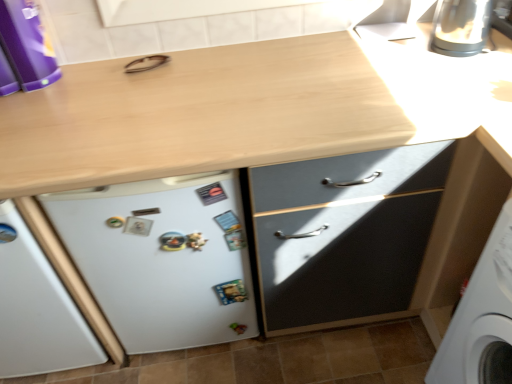
The width and height of the screenshot is (512, 384). What do you see at coordinates (161, 258) in the screenshot?
I see `white matte refrigerator at lower left` at bounding box center [161, 258].

Identify the location of satin silver kettle at upper right. [461, 27].

Does white matte refrigerator at lower left have a greater width compared to satin silver kettle at upper right?

In fact, white matte refrigerator at lower left might be narrower than satin silver kettle at upper right.

Is white matte refrigerator at lower left looking in the opposite direction of satin silver kettle at upper right?

No, satin silver kettle at upper right is not at the back of white matte refrigerator at lower left.

Considering the relative sizes of white matte refrigerator at lower left and satin silver kettle at upper right in the image provided, is white matte refrigerator at lower left smaller than satin silver kettle at upper right?

Incorrect, white matte refrigerator at lower left is not smaller in size than satin silver kettle at upper right.

From a real-world perspective, which object stands above the other?

In real-world perspective, satin silver kettle at upper right is above.

Which object is further away from the camera taking this photo, purple plastic container at upper left or satin silver kettle at upper right?

satin silver kettle at upper right is further away from the camera.

Can you confirm if purple plastic container at upper left is taller than satin silver kettle at upper right?

Correct, purple plastic container at upper left is much taller as satin silver kettle at upper right.

Is point (46, 82) positioned in front of point (445, 50)?

No.

From the image's perspective, is satin silver kettle at upper right below white matte refrigerator at lower left?

No.

Considering the relative positions of satin silver kettle at upper right and white matte refrigerator at lower left in the image provided, is satin silver kettle at upper right to the right of white matte refrigerator at lower left from the viewer's perspective?

Indeed, satin silver kettle at upper right is positioned on the right side of white matte refrigerator at lower left.

Does satin silver kettle at upper right have a smaller size compared to white matte refrigerator at lower left?

Yes, satin silver kettle at upper right is smaller than white matte refrigerator at lower left.

Could you tell me if satin silver kettle at upper right is facing white matte refrigerator at lower left?

No, satin silver kettle at upper right is not aimed at white matte refrigerator at lower left.

Considering the relative sizes of purple plastic container at upper left and white matte refrigerator at lower left in the image provided, is purple plastic container at upper left bigger than white matte refrigerator at lower left?

No, purple plastic container at upper left is not bigger than white matte refrigerator at lower left.

Is purple plastic container at upper left taller or shorter than white matte refrigerator at lower left?

Considering their sizes, purple plastic container at upper left has less height than white matte refrigerator at lower left.

From a real-world perspective, is purple plastic container at upper left above or below white matte refrigerator at lower left?

Clearly, from a real-world perspective, purple plastic container at upper left is above white matte refrigerator at lower left.

Consider the image. From the image's perspective, which object appears higher, purple plastic container at upper left or white matte refrigerator at lower left?

purple plastic container at upper left.

From the image's perspective, which object appears higher, satin silver kettle at upper right or purple plastic container at upper left?

satin silver kettle at upper right.

Considering the sizes of satin silver kettle at upper right and purple plastic container at upper left in the image, is satin silver kettle at upper right wider or thinner than purple plastic container at upper left?

In the image, satin silver kettle at upper right appears to be wider than purple plastic container at upper left.

From a real-world perspective, is satin silver kettle at upper right above or below purple plastic container at upper left?

In terms of real-world spatial position, satin silver kettle at upper right is below purple plastic container at upper left.

Would you say satin silver kettle at upper right is to the left or to the right of purple plastic container at upper left in the picture?

From the image, it's evident that satin silver kettle at upper right is to the right of purple plastic container at upper left.

Identify the location of kitchen appliance that is on the left side of white matte refrigerator at lower left. The height and width of the screenshot is (384, 512). (27, 45).

From a real-world perspective, between white matte refrigerator at lower left and purple plastic container at upper left, who is vertically lower?

white matte refrigerator at lower left, from a real-world perspective.

Is white matte refrigerator at lower left closer to camera compared to purple plastic container at upper left?

No.

Which is less distant, (160, 181) or (33, 42)?

Point (160, 181).

Image resolution: width=512 pixels, height=384 pixels. I want to click on appliance that appears behind the white matte refrigerator at lower left, so click(x=461, y=27).

At what (x,y) coordinates should I click in order to perform the action: click on kitchen appliance that is in front of the satin silver kettle at upper right. Please return your answer as a coordinate pair (x, y). Image resolution: width=512 pixels, height=384 pixels. Looking at the image, I should click on (27, 45).

Consider the image. Estimate the real-world distances between objects in this image. Which object is closer to satin silver kettle at upper right, purple plastic container at upper left or white matte refrigerator at lower left?

Among the two, white matte refrigerator at lower left is located nearer to satin silver kettle at upper right.

From the image, which object appears to be farther from white matte refrigerator at lower left, satin silver kettle at upper right or purple plastic container at upper left?

Based on the image, satin silver kettle at upper right appears to be further to white matte refrigerator at lower left.

Estimate the real-world distances between objects in this image. Which object is closer to purple plastic container at upper left, satin silver kettle at upper right or white matte refrigerator at lower left?

white matte refrigerator at lower left is positioned closer to the anchor purple plastic container at upper left.

When comparing their distances from satin silver kettle at upper right, does white matte refrigerator at lower left or purple plastic container at upper left seem further?

Based on the image, purple plastic container at upper left appears to be further to satin silver kettle at upper right.

Consider the image. Estimate the real-world distances between objects in this image. Which object is closer to purple plastic container at upper left, white matte refrigerator at lower left or satin silver kettle at upper right?

white matte refrigerator at lower left.

Which object lies further to the anchor point white matte refrigerator at lower left, purple plastic container at upper left or satin silver kettle at upper right?

Based on the image, satin silver kettle at upper right appears to be further to white matte refrigerator at lower left.

You are a GUI agent. You are given a task and a screenshot of the screen. Output one action in this format:
    pyautogui.click(x=<x>, y=<y>)
    Task: Click on the refrigerator located between purple plastic container at upper left and satin silver kettle at upper right in the left-right direction
    
    Given the screenshot: What is the action you would take?
    pyautogui.click(x=161, y=258)